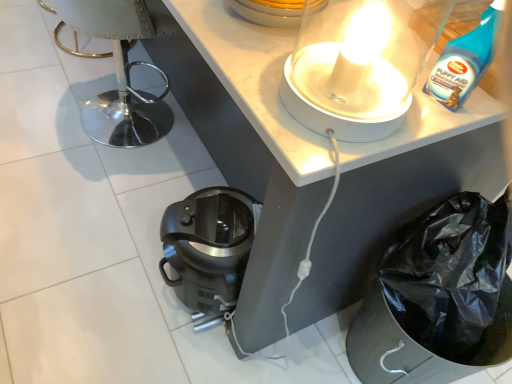
Question: From the image's perspective, relative to white glossy lamp at upper center, is matte black coffee maker at lower center above or below?

Choices:
 (A) below
 (B) above

Answer: (B)

Question: Do you think matte black coffee maker at lower center is within white glossy lamp at upper center, or outside of it?

Choices:
 (A) outside
 (B) inside

Answer: (A)

Question: Estimate the real-world distances between objects in this image. Which object is closer to the white glossy lamp at upper center?

Choices:
 (A) metallic silver swivel chair at left
 (B) matte black coffee maker at lower center
 (C) black plastic coffee maker at lower center
 (D) blue plastic bottle at upper right

Answer: (D)

Question: Which is farther from the metallic silver swivel chair at left?

Choices:
 (A) white glossy lamp at upper center
 (B) blue plastic bottle at upper right
 (C) black plastic coffee maker at lower center
 (D) matte black coffee maker at lower center

Answer: (B)